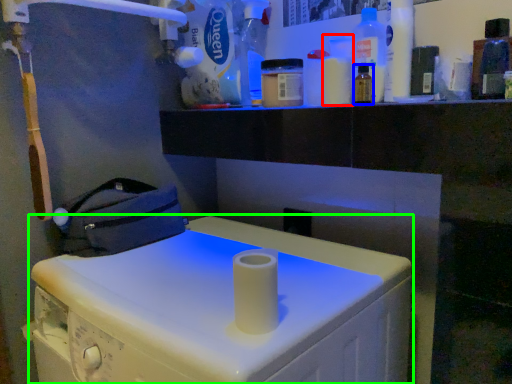
Question: Which object is the farthest from bottle (highlighted by a red box)? Choose among these: bottle (highlighted by a blue box) or machine (highlighted by a green box).

Choices:
 (A) bottle
 (B) machine

Answer: (B)